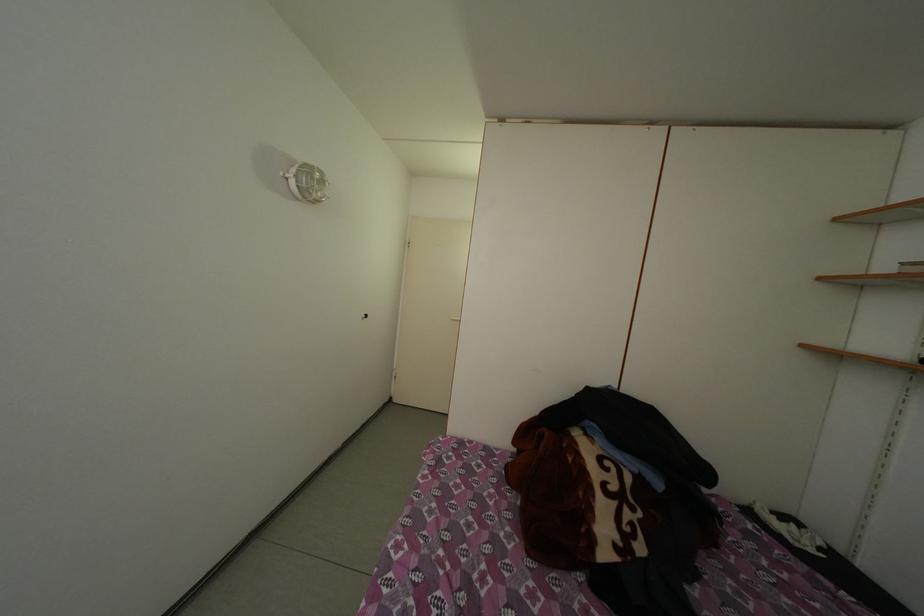
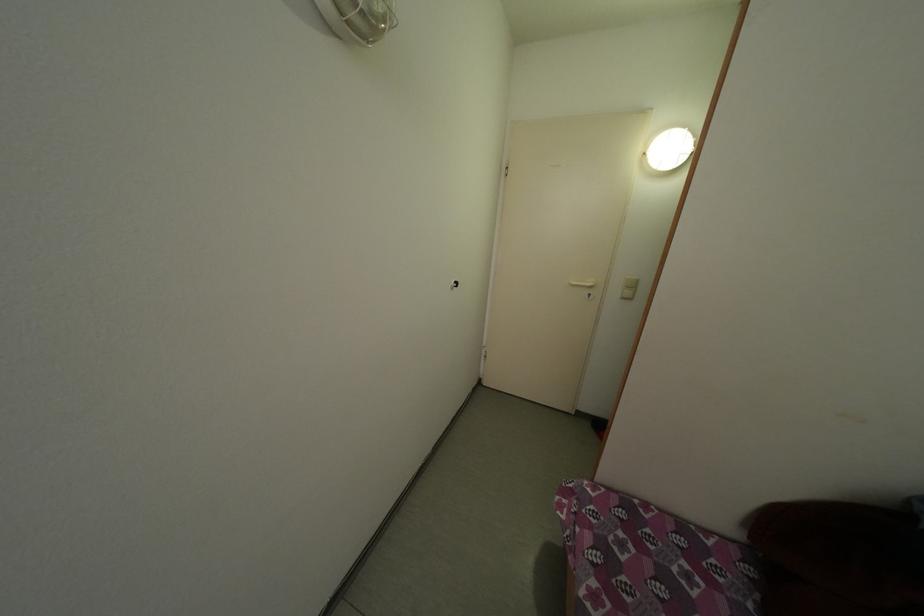
Question: The first image is from the beginning of the video and the second image is from the end. How did the camera likely rotate when shooting the video?

Choices:
 (A) Left
 (B) Right
 (C) Up
 (D) Down

Answer: (A)